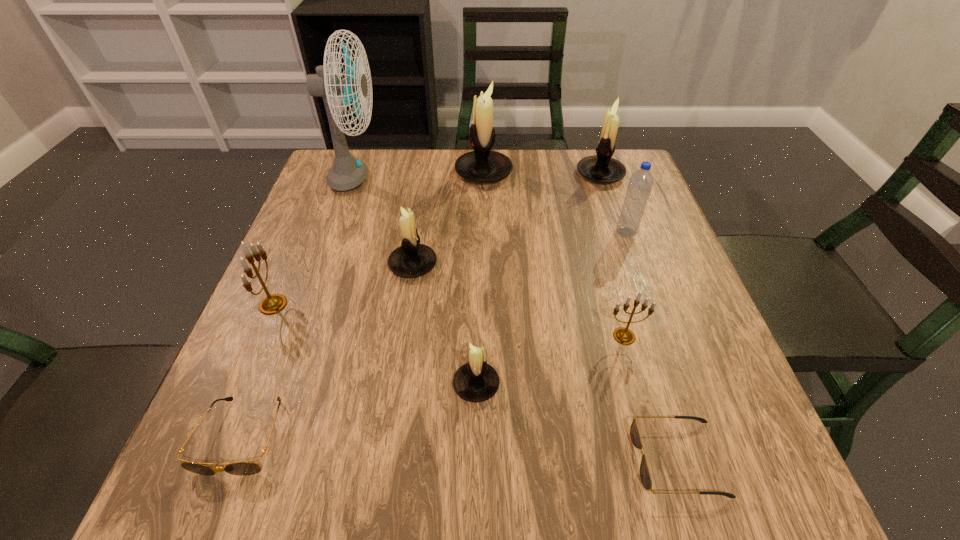
The height and width of the screenshot is (540, 960). Find the location of `free region located on the front of the rightmost white candle holder`. free region located on the front of the rightmost white candle holder is located at coordinates (644, 303).

Where is `free space located 0.190m on the left of the blue water bottle`? The width and height of the screenshot is (960, 540). free space located 0.190m on the left of the blue water bottle is located at coordinates (535, 232).

In order to click on free region located 0.270m on the front of the second candle holder from left to right in this screenshot , I will do `click(393, 399)`.

The height and width of the screenshot is (540, 960). Find the location of `vacant point located 0.070m on the back of the fourth farthest candle holder`. vacant point located 0.070m on the back of the fourth farthest candle holder is located at coordinates (291, 264).

I want to click on vacant region located 0.110m on the back of the fifth farthest candle holder, so click(610, 286).

Find the location of a particular element. This screenshot has width=960, height=540. free space located 0.150m on the front of the smallest white candle holder is located at coordinates (475, 503).

Where is `vacant space located 0.200m on the front-facing side of the right sunglasses`? The image size is (960, 540). vacant space located 0.200m on the front-facing side of the right sunglasses is located at coordinates (504, 458).

Find the location of `free space located 0.140m on the front-facing side of the right sunglasses`. free space located 0.140m on the front-facing side of the right sunglasses is located at coordinates (543, 458).

Image resolution: width=960 pixels, height=540 pixels. Identify the location of free location located on the front-facing side of the right sunglasses. (477, 458).

Locate an element on the screen. This screenshot has height=540, width=960. fan at the far edge is located at coordinates (346, 173).